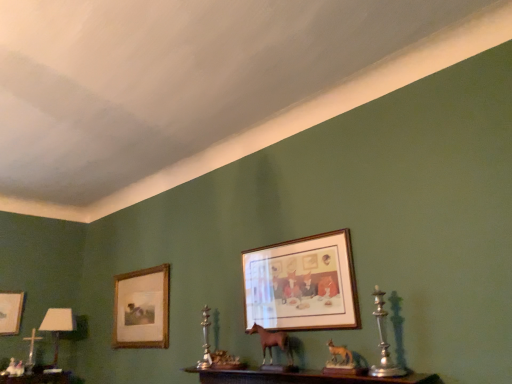
Question: Is wooden frame at center, the first picture frame from the front, smaller than white glossy table lamp at lower left?

Choices:
 (A) no
 (B) yes

Answer: (B)

Question: Does wooden frame at center, the first picture frame positioned from the right, come in front of white glossy table lamp at lower left?

Choices:
 (A) no
 (B) yes

Answer: (B)

Question: Can you confirm if wooden frame at center, which appears as the 3th picture frame when viewed from the left, is thinner than white glossy table lamp at lower left?

Choices:
 (A) no
 (B) yes

Answer: (B)

Question: From the image's perspective, does wooden frame at center, the first picture frame positioned from the right, appear higher than white glossy table lamp at lower left?

Choices:
 (A) no
 (B) yes

Answer: (B)

Question: Considering the relative sizes of wooden frame at center, the first picture frame from the front, and white glossy table lamp at lower left in the image provided, is wooden frame at center, the first picture frame from the front, wider than white glossy table lamp at lower left?

Choices:
 (A) yes
 (B) no

Answer: (B)

Question: Is wooden frame at center, the first picture frame from the front, taller than white glossy table lamp at lower left?

Choices:
 (A) no
 (B) yes

Answer: (A)

Question: Considering the relative positions of brown matte horse at center and white glossy table lamp at lower left in the image provided, is brown matte horse at center behind white glossy table lamp at lower left?

Choices:
 (A) yes
 (B) no

Answer: (B)

Question: Is brown matte horse at center bigger than white glossy table lamp at lower left?

Choices:
 (A) yes
 (B) no

Answer: (B)

Question: Considering the relative positions of brown matte horse at center and white glossy table lamp at lower left in the image provided, is brown matte horse at center to the right of white glossy table lamp at lower left from the viewer's perspective?

Choices:
 (A) no
 (B) yes

Answer: (B)

Question: From the image's perspective, does brown matte horse at center appear higher than white glossy table lamp at lower left?

Choices:
 (A) no
 (B) yes

Answer: (B)

Question: Is white glossy table lamp at lower left at the back of brown matte horse at center?

Choices:
 (A) yes
 (B) no

Answer: (B)

Question: Is white glossy table lamp at lower left inside brown matte horse at center?

Choices:
 (A) yes
 (B) no

Answer: (B)

Question: From a real-world perspective, is white glossy table lamp at lower left physically below wooden picture frame at left, which ranks as the 2th picture frame in right-to-left order?

Choices:
 (A) no
 (B) yes

Answer: (B)